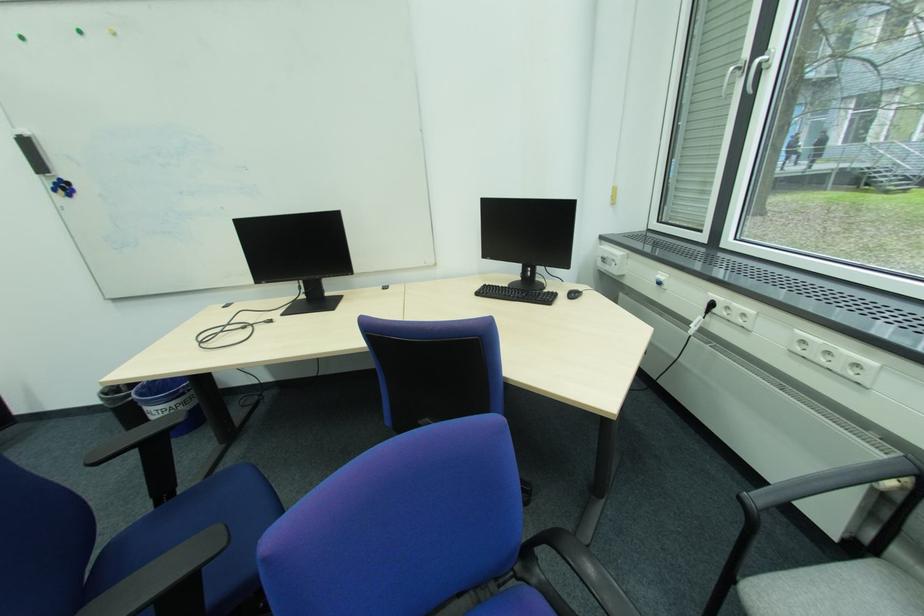
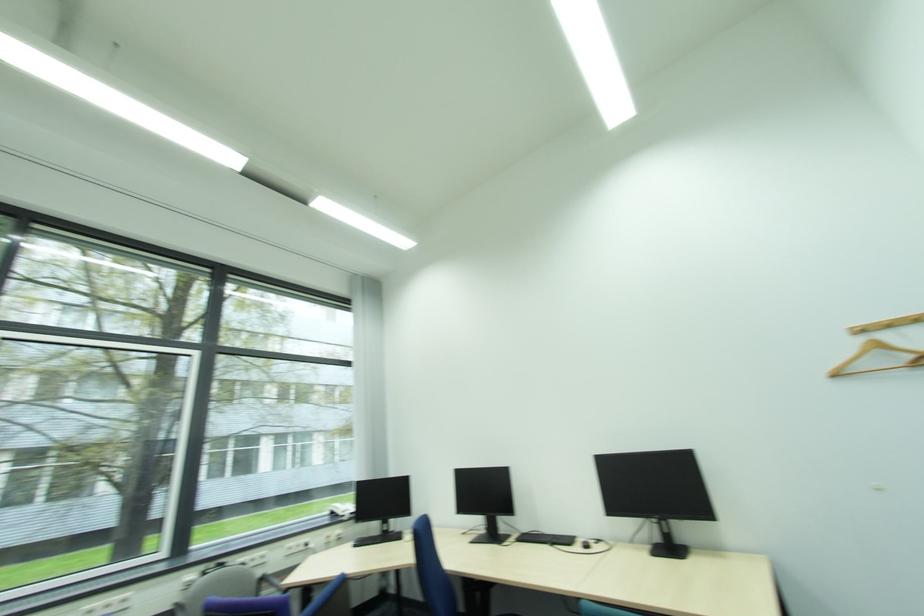
The point at (x=835, y=354) is marked in the first image. Where is the corresponding point in the second image?

(114, 607)